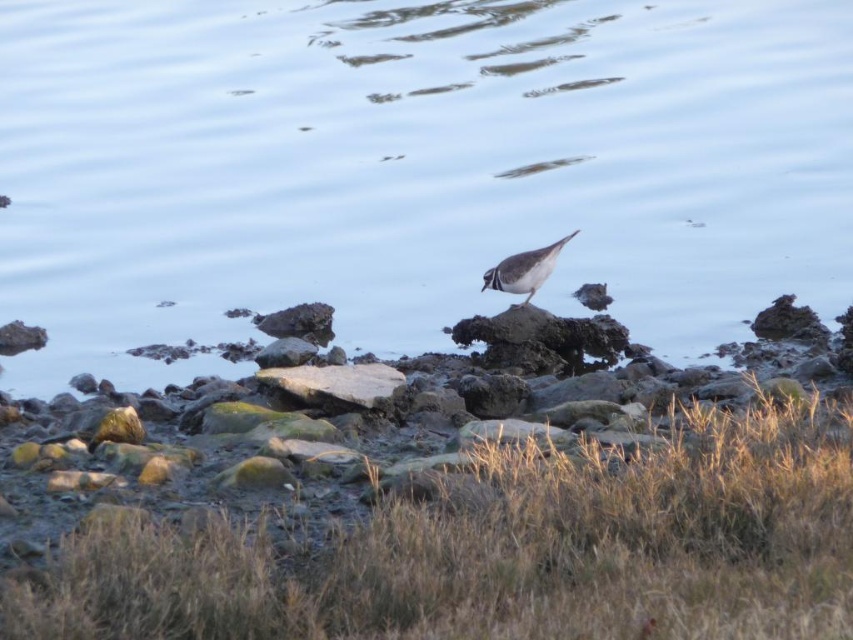
Can you confirm if rough textured rock at center is positioned above brown speckled feathers at center?

Actually, rough textured rock at center is below brown speckled feathers at center.

Does rough textured rock at center lie behind brown speckled feathers at center?

No, rough textured rock at center is closer to the viewer.

Is point (225, 384) positioned behind point (544, 273)?

No, (225, 384) is closer to viewer.

This screenshot has width=853, height=640. Identify the location of rough textured rock at center. (339, 432).

Between point (358, 68) and point (131, 417), which one is positioned behind?

The point (358, 68) is more distant.

Can you confirm if clear water at center is taller than rough textured rock at center?

Incorrect, clear water at center's height is not larger of rough textured rock at center's.

Which is in front, point (238, 282) or point (584, 388)?

Point (584, 388) is more forward.

Locate an element on the screen. clear water at center is located at coordinates (410, 170).

Which is below, clear water at center or brown speckled feathers at center?

brown speckled feathers at center is below.

Does point (665, 278) lie behind point (538, 280)?

Yes.

Find the location of a particular element. clear water at center is located at coordinates (410, 170).